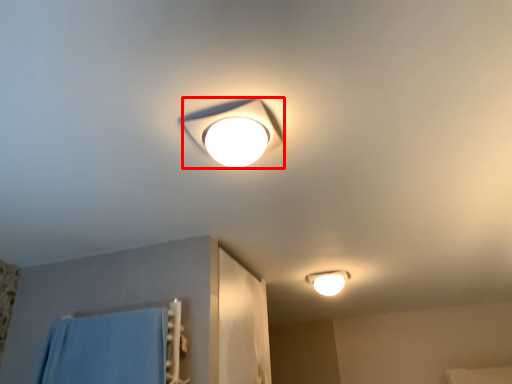
Question: From the image's perspective, what is the correct spatial positioning of lamp (annotated by the red box) in reference to lamp?

Choices:
 (A) above
 (B) below

Answer: (A)